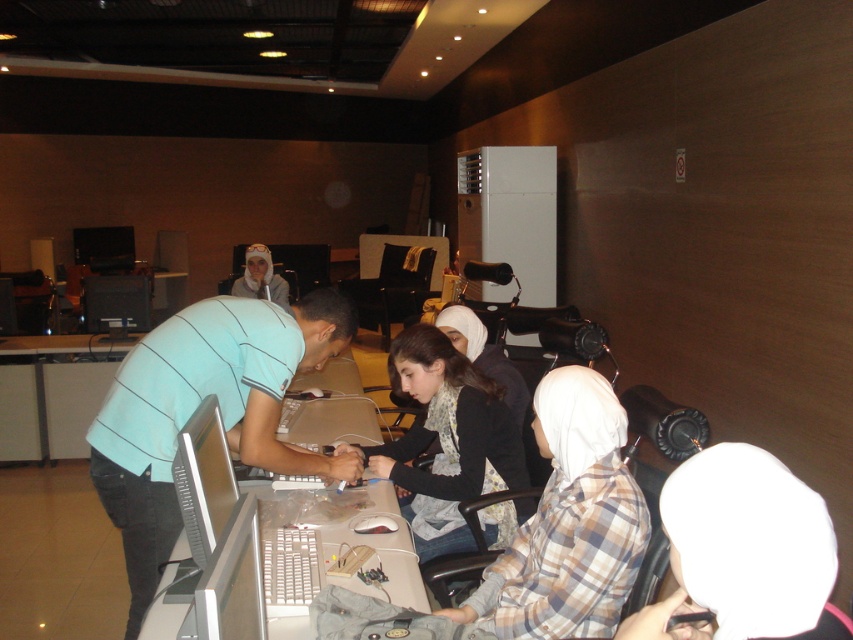
Who is taller, plaid fabric shirt at center or matte white hijab at center?

Standing taller between the two is plaid fabric shirt at center.

Is plaid fabric shirt at center to the left of matte white hijab at center from the viewer's perspective?

Incorrect, plaid fabric shirt at center is not on the left side of matte white hijab at center.

Locate an element on the screen. The image size is (853, 640). plaid fabric shirt at center is located at coordinates (567, 524).

Does point (238, 618) come farther from viewer compared to point (190, 477)?

That is False.

Where is `matte plastic monitor at center`? The image size is (853, 640). matte plastic monitor at center is located at coordinates (231, 580).

Is white plastic computer at center to the left of matte black monitor at upper left from the viewer's perspective?

Incorrect, white plastic computer at center is not on the left side of matte black monitor at upper left.

Consider the image. Is white plastic computer at center behind matte black monitor at upper left?

No.

This screenshot has height=640, width=853. I want to click on white plastic computer at center, so click(x=196, y=477).